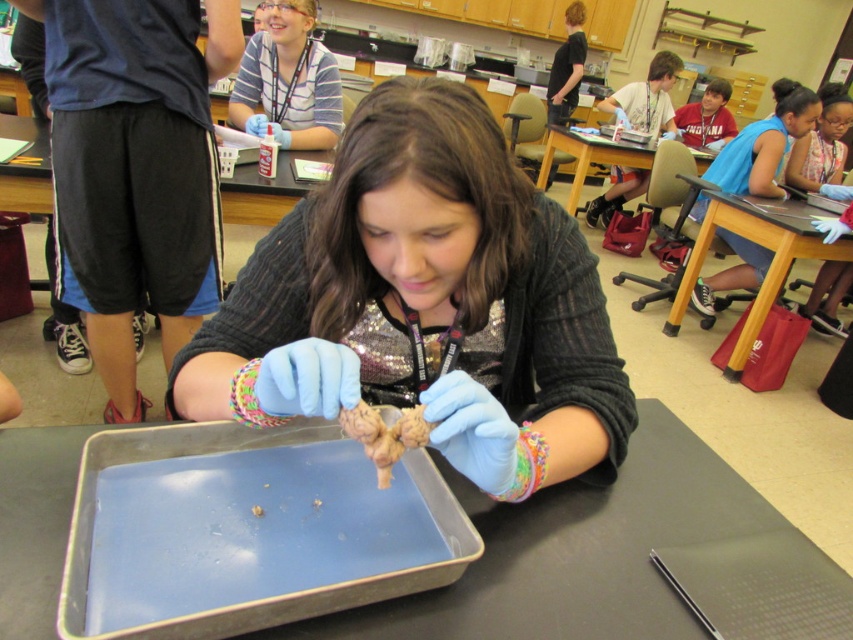
Is sparkly sequin shirt at center below brown textured root vegetable at center?

No.

What do you see at coordinates (424, 301) in the screenshot? This screenshot has height=640, width=853. I see `sparkly sequin shirt at center` at bounding box center [424, 301].

Where is `sparkly sequin shirt at center`? sparkly sequin shirt at center is located at coordinates (424, 301).

Between sparkly sequin shirt at center and blue plastic tray at center, which one is positioned lower?

blue plastic tray at center is below.

Between sparkly sequin shirt at center and blue plastic tray at center, which one is positioned higher?

sparkly sequin shirt at center is above.

Locate an element on the screen. sparkly sequin shirt at center is located at coordinates (424, 301).

At what (x,y) coordinates should I click in order to perform the action: click on sparkly sequin shirt at center. Please return your answer as a coordinate pair (x, y). Image resolution: width=853 pixels, height=640 pixels. Looking at the image, I should click on (424, 301).

Does metallic gray tray at center have a lesser width compared to matte plastic table at center?

No, metallic gray tray at center is not thinner than matte plastic table at center.

This screenshot has width=853, height=640. What do you see at coordinates (576, 552) in the screenshot? I see `metallic gray tray at center` at bounding box center [576, 552].

Identify the location of metallic gray tray at center. (576, 552).